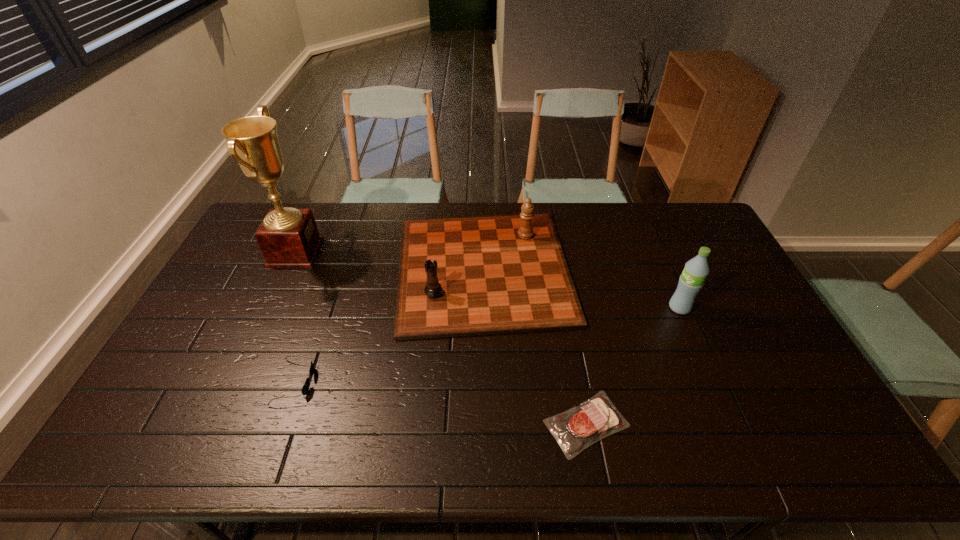
The width and height of the screenshot is (960, 540). What are the coordinates of `trophy cup` in the screenshot? It's located at (288, 237).

I want to click on the tallest object, so click(x=288, y=237).

This screenshot has height=540, width=960. Find the location of `the second tallest object`. the second tallest object is located at coordinates (692, 279).

You are a GUI agent. You are given a task and a screenshot of the screen. Output one action in this format:
    pyautogui.click(x=<x>, y=<y>)
    Task: Click on the water bottle
    This screenshot has width=960, height=540.
    Given the screenshot: What is the action you would take?
    pyautogui.click(x=692, y=279)

Find the location of `the third tallest object`. the third tallest object is located at coordinates (494, 274).

Where is `the fourth object from right to left`? the fourth object from right to left is located at coordinates (305, 388).

Where is `the second shortest object`? This screenshot has width=960, height=540. the second shortest object is located at coordinates (305, 388).

Where is `steak`? The height and width of the screenshot is (540, 960). steak is located at coordinates (576, 429).

This screenshot has height=540, width=960. In order to click on free location located 0.380m on the plaque of the leftmost object in this screenshot , I will do (x=427, y=252).

The width and height of the screenshot is (960, 540). What are the coordinates of `free space located on the left of the rightmost object` in the screenshot? It's located at (555, 308).